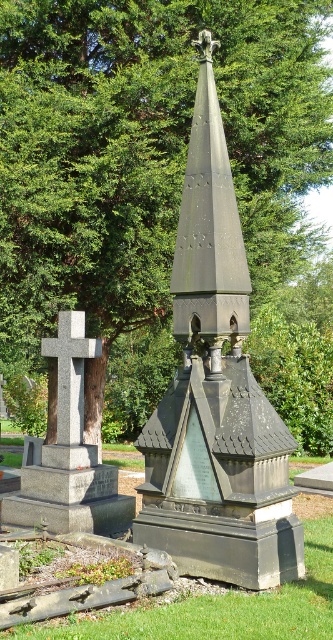
Question: Among these points, which one is nearest to the camera?

Choices:
 (A) (217, 452)
 (B) (11, 513)
 (C) (190, 234)
 (D) (72, 314)

Answer: (A)

Question: Among these points, which one is nearest to the camera?

Choices:
 (A) (202, 236)
 (B) (63, 481)
 (C) (305, 19)
 (D) (217, 492)

Answer: (D)

Question: Is green leafy tree at upper center smaller than granite cross at center?

Choices:
 (A) yes
 (B) no

Answer: (B)

Question: Is green leafy tree at upper center thinner than dark gray stone spire at center?

Choices:
 (A) no
 (B) yes

Answer: (A)

Question: Does dark gray stone monument at center have a lesser width compared to granite cross at center?

Choices:
 (A) yes
 (B) no

Answer: (B)

Question: Which object is closer to the camera taking this photo?

Choices:
 (A) dark gray stone spire at center
 (B) green leafy tree at upper center
 (C) dark gray stone monument at center
 (D) granite cross at center

Answer: (C)